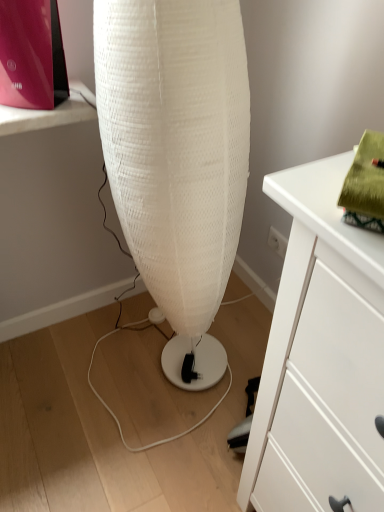
Locate an element on the screen. The width and height of the screenshot is (384, 512). free space below white mesh lamp at center (from a real-world perspective) is located at coordinates (161, 372).